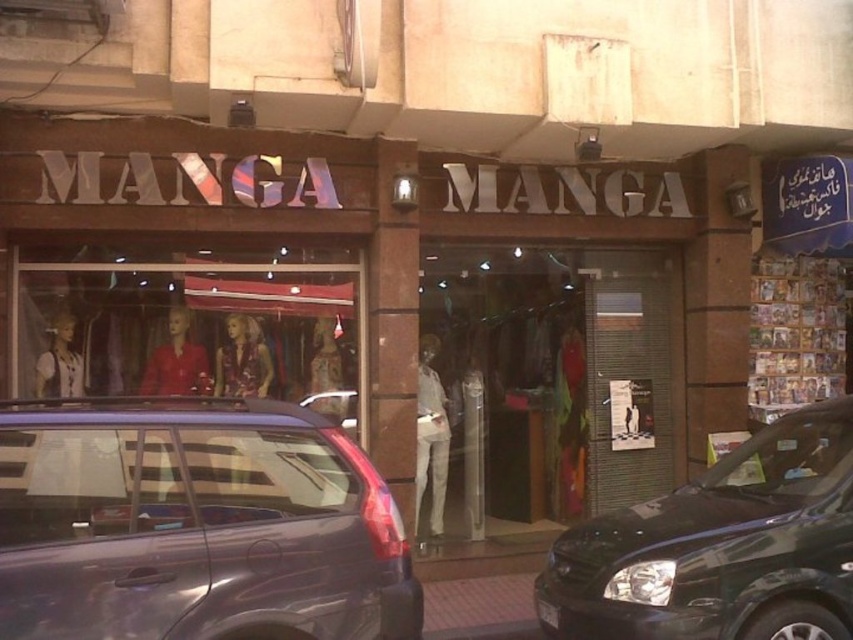
Between satin purple car at lower left and black plastic license plate at center, which one appears on the right side from the viewer's perspective?

black plastic license plate at center

Consider the image. Who is more forward, (x=56, y=577) or (x=548, y=605)?

Positioned in front is point (x=56, y=577).

The image size is (853, 640). I want to click on satin purple car at lower left, so click(195, 524).

Can you confirm if shiny black car at right is wider than black plastic license plate at center?

Yes, shiny black car at right is wider than black plastic license plate at center.

This screenshot has height=640, width=853. What do you see at coordinates (722, 547) in the screenshot?
I see `shiny black car at right` at bounding box center [722, 547].

At what (x,y) coordinates should I click in order to perform the action: click on shiny black car at right. Please return your answer as a coordinate pair (x, y). Looking at the image, I should click on (722, 547).

Is satin purple car at lower left to the right of matte glass mannequins at center from the viewer's perspective?

Yes, satin purple car at lower left is to the right of matte glass mannequins at center.

Locate an element on the screen. The image size is (853, 640). satin purple car at lower left is located at coordinates (195, 524).

Is point (361, 579) farther from viewer compared to point (260, 378)?

No, it is in front of (260, 378).

I want to click on satin purple car at lower left, so click(x=195, y=524).